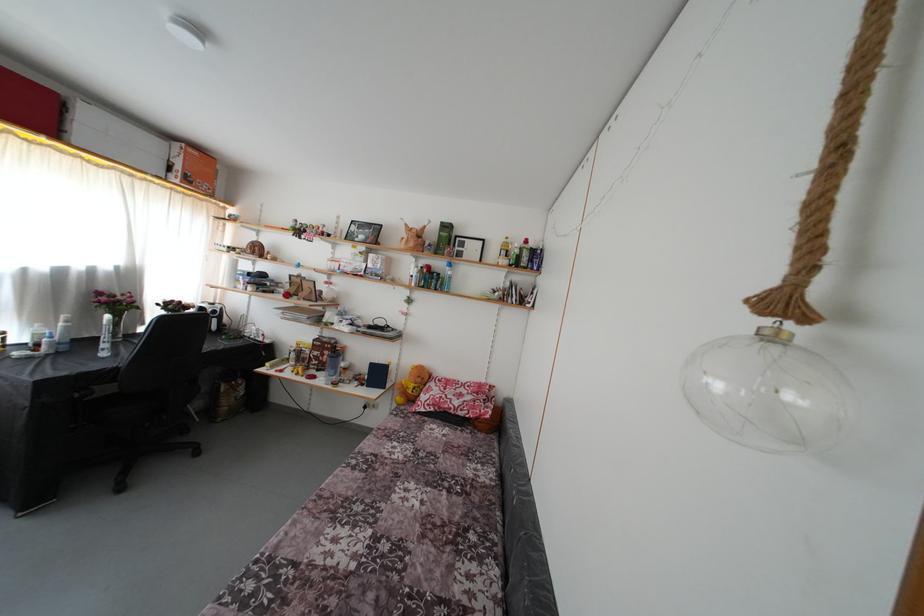
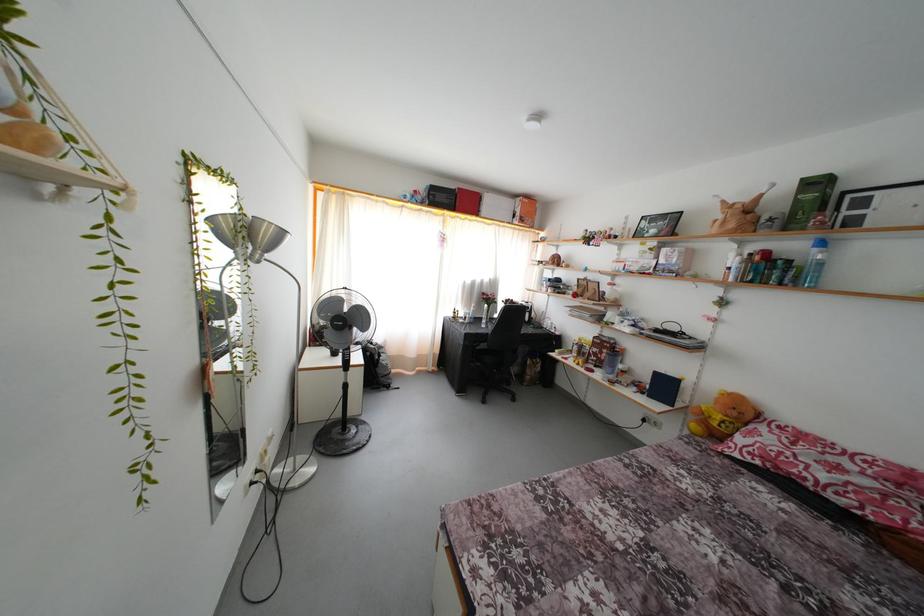
Question: The images are taken continuously from a first-person perspective. In which direction is your viewpoint rotating?

Choices:
 (A) Left
 (B) Right
 (C) Up
 (D) Down

Answer: (A)